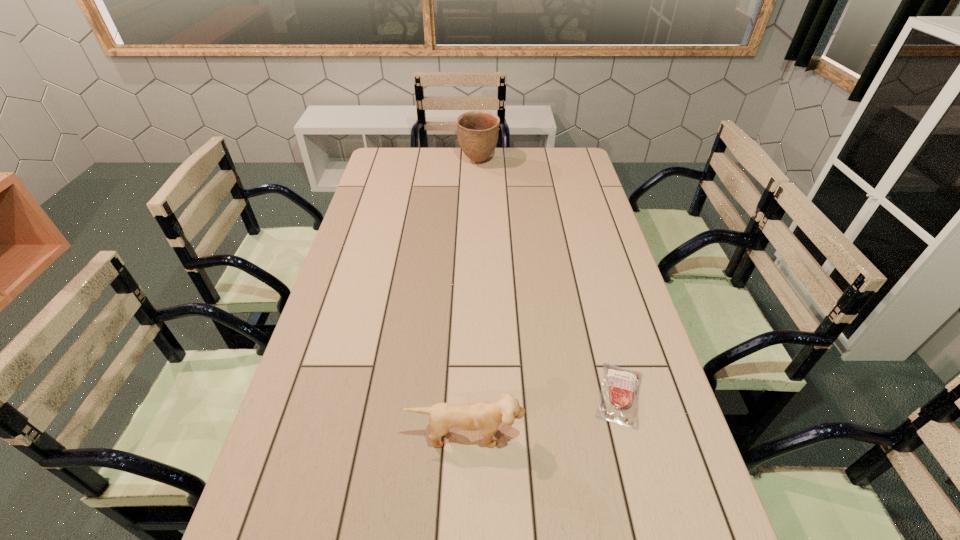
Where is `free space between the farthest object and the puppy`? The width and height of the screenshot is (960, 540). free space between the farthest object and the puppy is located at coordinates (472, 298).

Locate an element on the screen. This screenshot has width=960, height=540. vacant area between the tallest object and the second shortest object is located at coordinates (472, 298).

You are a GUI agent. You are given a task and a screenshot of the screen. Output one action in this format:
    pyautogui.click(x=<x>, y=<y>)
    Task: Click on the empty location between the second tallest object and the tallest object
    This screenshot has height=540, width=960.
    Given the screenshot: What is the action you would take?
    pyautogui.click(x=472, y=298)

Locate which object is the second closest to the pottery. Please provide its 2D coordinates. Your answer should be formatted as a tuple, i.e. [(x, y)], where the tuple contains the x and y coordinates of a point satisfying the conditions above.

[(486, 416)]

Select which object is the second closest to the tallest object. Please provide its 2D coordinates. Your answer should be formatted as a tuple, i.e. [(x, y)], where the tuple contains the x and y coordinates of a point satisfying the conditions above.

[(486, 416)]

Locate an element on the screen. The width and height of the screenshot is (960, 540). free location that satisfies the following two spatial constraints: 1. on the front side of the rightmost object; 2. on the right side of the farthest object is located at coordinates (477, 394).

Locate an element on the screen. free location that satisfies the following two spatial constraints: 1. on the front side of the shortest object; 2. on the right side of the tallest object is located at coordinates (477, 394).